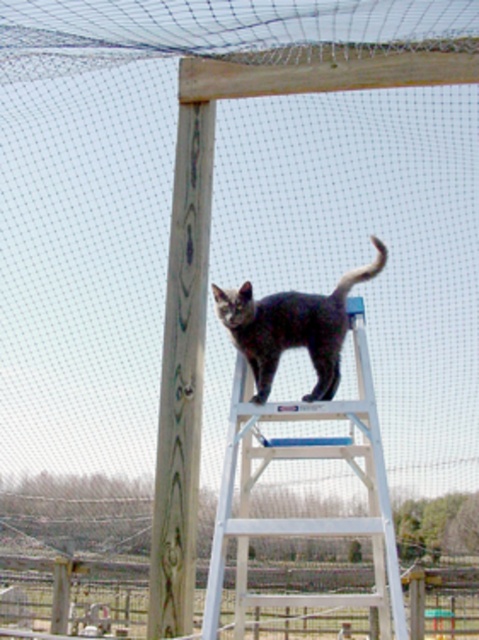
Which is more to the left, white plastic ladder at center or wooden pole at center?

wooden pole at center

Can you confirm if white plastic ladder at center is positioned below wooden pole at center?

Correct, white plastic ladder at center is located below wooden pole at center.

Between point (330, 454) and point (209, 224), which one is positioned in front?

Point (330, 454)

Where is `white plastic ladder at center`? white plastic ladder at center is located at coordinates (307, 516).

Can you confirm if wooden pole at center is positioned to the right of gray fur cat at center?

Incorrect, wooden pole at center is not on the right side of gray fur cat at center.

Based on the photo, is wooden pole at center thinner than gray fur cat at center?

Yes.

Who is more forward, (x=174, y=531) or (x=365, y=268)?

Point (x=365, y=268)

Locate an element on the screen. Image resolution: width=479 pixels, height=640 pixels. wooden pole at center is located at coordinates (182, 372).

Is white plastic ladder at center further to camera compared to gray fur cat at center?

No, white plastic ladder at center is in front of gray fur cat at center.

In the scene shown: Who is lower down, white plastic ladder at center or gray fur cat at center?

white plastic ladder at center is below.

Where is `white plastic ladder at center`? white plastic ladder at center is located at coordinates (307, 516).